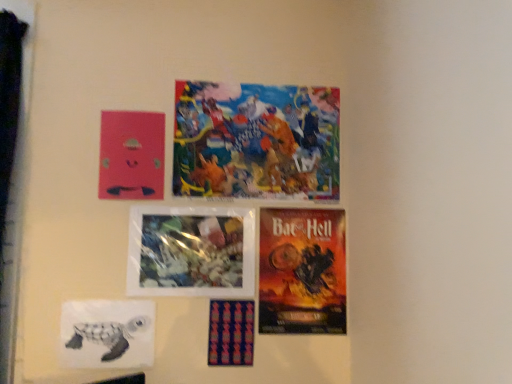
Question: Is textured fabric poster at center, the sixth poster from the top, at the right side of orange matte poster at lower right, positioned as the 4th poster in top-to-bottom order?

Choices:
 (A) no
 (B) yes

Answer: (A)

Question: Is textured fabric poster at center, the sixth poster from the top, oriented away from orange matte poster at lower right, positioned as the 4th poster in top-to-bottom order?

Choices:
 (A) yes
 (B) no

Answer: (B)

Question: Considering the relative sizes of textured fabric poster at center, marked as the 1th poster in a bottom-to-top arrangement, and orange matte poster at lower right, acting as the 3th poster starting from the bottom, in the image provided, is textured fabric poster at center, marked as the 1th poster in a bottom-to-top arrangement, wider than orange matte poster at lower right, acting as the 3th poster starting from the bottom,?

Choices:
 (A) no
 (B) yes

Answer: (B)

Question: From the image's perspective, is textured fabric poster at center, the sixth poster from the top, beneath orange matte poster at lower right, acting as the 3th poster starting from the bottom?

Choices:
 (A) yes
 (B) no

Answer: (A)

Question: Does textured fabric poster at center, the sixth poster from the top, have a lesser width compared to orange matte poster at lower right, positioned as the 4th poster in top-to-bottom order?

Choices:
 (A) no
 (B) yes

Answer: (A)

Question: Is textured fabric poster at center, the sixth poster from the top, not within orange matte poster at lower right, positioned as the 4th poster in top-to-bottom order?

Choices:
 (A) no
 (B) yes

Answer: (B)

Question: Is colorful collage at upper center, the first poster viewed from the top, next to textured fabric poster at center, marked as the 1th poster in a bottom-to-top arrangement?

Choices:
 (A) no
 (B) yes

Answer: (A)

Question: Does colorful collage at upper center, marked as the sixth poster in a bottom-to-top arrangement, have a lesser height compared to textured fabric poster at center, marked as the 1th poster in a bottom-to-top arrangement?

Choices:
 (A) yes
 (B) no

Answer: (B)

Question: Would you consider colorful collage at upper center, the first poster viewed from the top, to be distant from textured fabric poster at center, marked as the 1th poster in a bottom-to-top arrangement?

Choices:
 (A) yes
 (B) no

Answer: (B)

Question: Does colorful collage at upper center, the first poster viewed from the top, have a larger size compared to textured fabric poster at center, the sixth poster from the top?

Choices:
 (A) yes
 (B) no

Answer: (A)

Question: From a real-world perspective, is colorful collage at upper center, marked as the sixth poster in a bottom-to-top arrangement, under textured fabric poster at center, the sixth poster from the top?

Choices:
 (A) no
 (B) yes

Answer: (A)

Question: Is colorful collage at upper center, marked as the sixth poster in a bottom-to-top arrangement, oriented away from textured fabric poster at center, the sixth poster from the top?

Choices:
 (A) yes
 (B) no

Answer: (B)

Question: Is pink matte poster at upper left, which is counted as the 5th poster, starting from the bottom, not close to orange matte poster at lower right, acting as the 3th poster starting from the bottom?

Choices:
 (A) no
 (B) yes

Answer: (A)